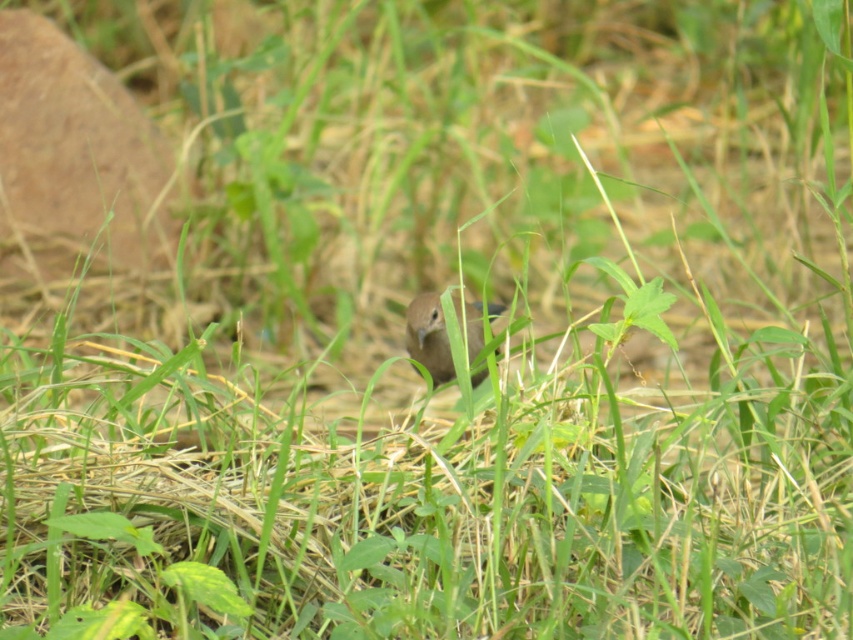
Does brown rock at upper left have a larger size compared to brown matte bird at center?

Yes, brown rock at upper left is bigger than brown matte bird at center.

Which of these two, brown rock at upper left or brown matte bird at center, stands taller?

With more height is brown rock at upper left.

Identify the location of brown rock at upper left. (76, 156).